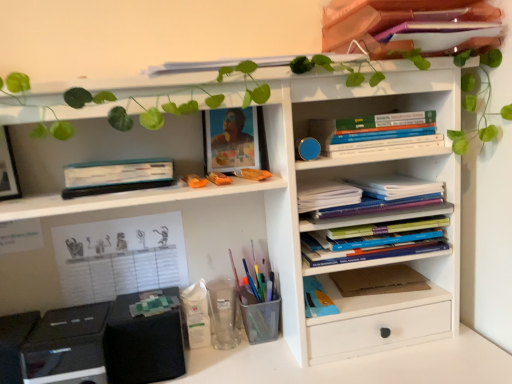
In order to click on free spot above brown cardboard at center-right, the 1th paperback book from the bottom (from a real-world perspective) in this screenshot , I will do `click(380, 280)`.